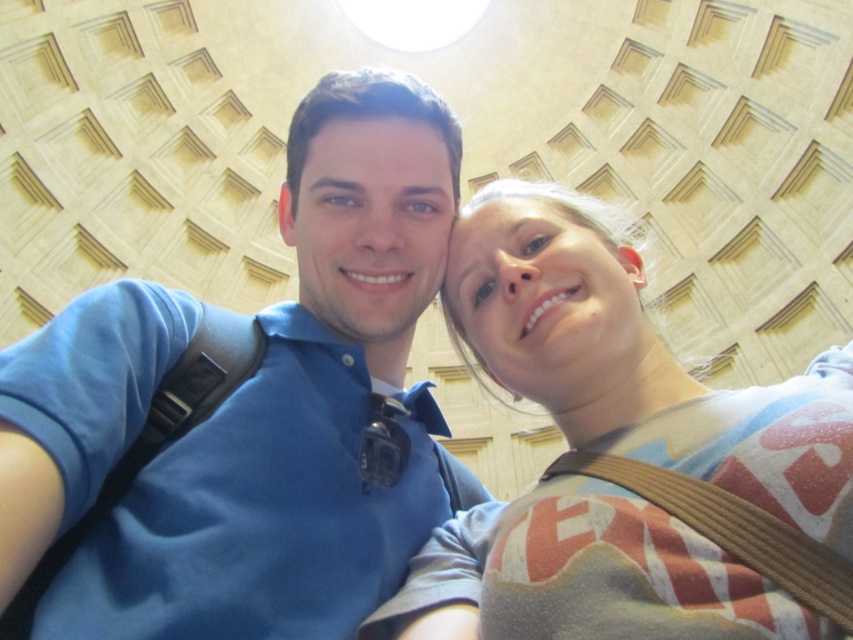
Question: Can you confirm if blue cotton shirt at center is bigger than light brown cotton shirt at center?

Choices:
 (A) no
 (B) yes

Answer: (B)

Question: Which of the following is the farthest from the observer?

Choices:
 (A) (341, 474)
 (B) (552, 604)

Answer: (A)

Question: Is blue cotton shirt at center below light brown cotton shirt at center?

Choices:
 (A) no
 (B) yes

Answer: (A)

Question: From the image, what is the correct spatial relationship of blue cotton shirt at center in relation to light brown cotton shirt at center?

Choices:
 (A) left
 (B) right

Answer: (A)

Question: Which point is closer to the camera?

Choices:
 (A) blue cotton shirt at center
 (B) light brown cotton shirt at center

Answer: (A)